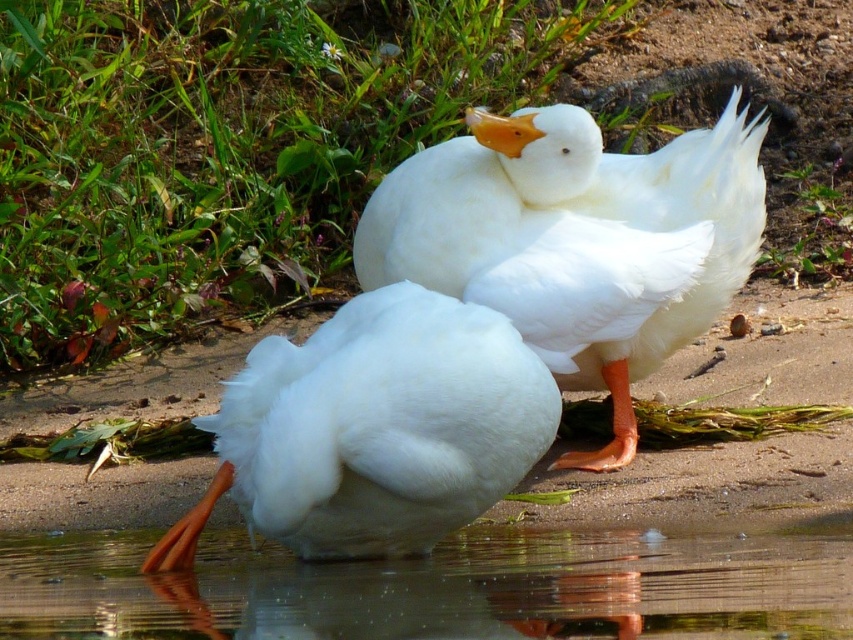
You are standing at a point 9.24 feet away from the camera, which is labeled as point (512, 269). You want to take a photo of the two white geese resting on the sandy ground. Will you be able to capture both geese in your photo if your camera has a standard 50mm lens with a field of view of 46 degrees?

The distance of point (512, 269) from the camera is 9.24 feet. To determine if both geese are in the frame, calculate the field of view coverage. At 50mm and 46 degrees, the horizontal coverage at 9.24 feet is approximately 7.4 feet. Since the geese are positioned close to each other on the sandy ground within this area, they should both fit within the camera frame.

You are a photographer aiming to capture both the white fluffy duck at center and the white fluffy duck at lower left in a single shot. However, you notice that one duck is blocking the view of the other. Which duck is obscuring the other?

The white fluffy duck at center is positioned over the white fluffy duck at lower left, so the duck at center is blocking the view of the one at lower left.

You are a bird watching enthusiast standing near the transparent water at lower center. You want to observe the white fluffy duck at lower left without disturbing it. Which direction should you move to get a better view of the duck?

Since the transparent water at lower center is located below the white fluffy duck at lower left, you should move towards the lower left direction to get a better view of the white fluffy duck at lower left without getting too close.